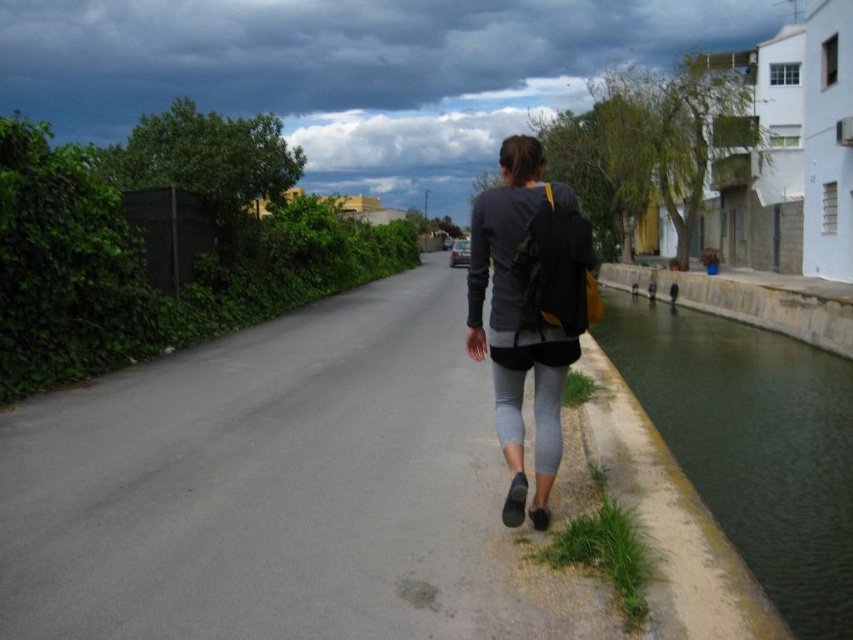
You are standing in the scene and want to cross the gray asphalt road at center to reach the buildings beyond the canal. Considering the distance, can you safely walk across without any equipment?

The gray asphalt road at center is 3.57 meters away from you, so yes, you can safely walk across it to reach the buildings beyond the canal as the distance is manageable without needing equipment.

You are a photographer trying to capture the entire scene of the green concrete canal at right and the gray matte leggings at center in one shot. Based on their sizes, which object should you focus on to ensure both are visible without cropping?

The green concrete canal at right is larger in size compared to the gray matte leggings at center, so focusing on the canal will ensure both are visible without cropping.

A person is walking on the gray asphalt road at center. If the person takes a step forward, how far will they be from their original position?

The person will be 3.57 meters away from their original position after taking a step forward.